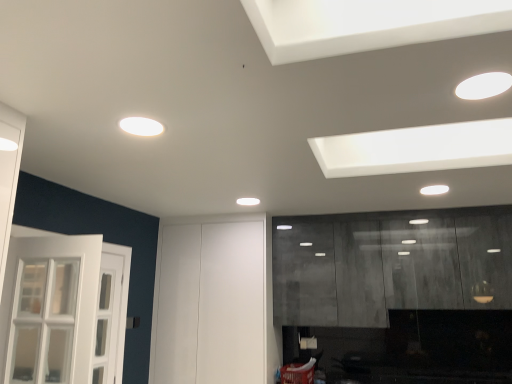
What is the approximate height of white matte light fixture at upper center, which is counted as the 1th lighting, starting from the back?

0.74 inches.

What do you see at coordinates (389, 264) in the screenshot? I see `matte gray cabinetry at right` at bounding box center [389, 264].

Locate an element on the screen. Image resolution: width=512 pixels, height=384 pixels. white matte door at center is located at coordinates (210, 302).

At what (x,y) coordinates should I click in order to perform the action: click on white glossy light fixture at upper right, the 1th lighting when ordered from right to left. Please return your answer as a coordinate pair (x, y). The height and width of the screenshot is (384, 512). Looking at the image, I should click on (484, 86).

Identify the location of white matte light fixture at upper center, the 1th lighting in the left-to-right sequence. The height and width of the screenshot is (384, 512). (141, 126).

Considering the relative positions of matte gray cabinetry at right and white matte light fixture at upper center, the second lighting when ordered from right to left, in the image provided, is matte gray cabinetry at right in front of white matte light fixture at upper center, the second lighting when ordered from right to left,?

No, matte gray cabinetry at right is further to the viewer.

From the image's perspective, which one is positioned higher, matte gray cabinetry at right or white matte light fixture at upper center, marked as the second lighting in a front-to-back arrangement?

white matte light fixture at upper center, marked as the second lighting in a front-to-back arrangement, appears higher in the image.

Is matte gray cabinetry at right facing towards white matte light fixture at upper center, which is the 1th lighting in bottom-to-top order?

Yes, matte gray cabinetry at right is oriented towards white matte light fixture at upper center, which is the 1th lighting in bottom-to-top order.

Is matte gray cabinetry at right not inside white matte light fixture at upper center, marked as the second lighting in a front-to-back arrangement?

Indeed, matte gray cabinetry at right is completely outside white matte light fixture at upper center, marked as the second lighting in a front-to-back arrangement.

Is white matte light fixture at upper center, the second lighting when ordered from right to left, positioned far away from matte gray cabinetry at right?

Indeed, white matte light fixture at upper center, the second lighting when ordered from right to left, is not near matte gray cabinetry at right.

Consider the image. Could you tell me if white matte light fixture at upper center, the 1th lighting in the left-to-right sequence, is facing matte gray cabinetry at right?

No, white matte light fixture at upper center, the 1th lighting in the left-to-right sequence, is not facing towards matte gray cabinetry at right.

Is white matte light fixture at upper center, the 2th lighting in the top-to-bottom sequence, bigger than matte gray cabinetry at right?

Incorrect, white matte light fixture at upper center, the 2th lighting in the top-to-bottom sequence, is not larger than matte gray cabinetry at right.

Locate an element on the screen. This screenshot has height=384, width=512. door below the white matte light fixture at upper center, marked as the second lighting in a front-to-back arrangement (from the image's perspective) is located at coordinates (210, 302).

Based on the photo, from a real-world perspective, which object stands above the other?

white matte light fixture at upper center, the 1th lighting in the left-to-right sequence, from a real-world perspective.

Is white matte light fixture at upper center, marked as the second lighting in a front-to-back arrangement, inside white matte door at center?

No, white matte door at center does not contain white matte light fixture at upper center, marked as the second lighting in a front-to-back arrangement.

Which of these two, white matte door at center or white matte light fixture at upper center, marked as the second lighting in a front-to-back arrangement, is bigger?

white matte door at center.

Are white matte light fixture at upper center, which is the 1th lighting in bottom-to-top order, and white matte door at center making contact?

They are not placed beside each other.

Considering the relative sizes of white matte light fixture at upper center, which is the 1th lighting in bottom-to-top order, and white matte door at center in the image provided, is white matte light fixture at upper center, which is the 1th lighting in bottom-to-top order, wider than white matte door at center?

Incorrect, the width of white matte light fixture at upper center, which is the 1th lighting in bottom-to-top order, does not surpass that of white matte door at center.

Which is correct: white matte light fixture at upper center, marked as the second lighting in a front-to-back arrangement, is inside white matte door at center, or outside of it?

white matte light fixture at upper center, marked as the second lighting in a front-to-back arrangement, is located beyond the bounds of white matte door at center.

Considering the points (134, 133) and (206, 275), which point is behind, point (134, 133) or point (206, 275)?

The point (206, 275) is farther from the camera.

Is white matte door at center far away from matte gray cabinetry at right?

No, white matte door at center is not far from matte gray cabinetry at right.

Is white matte door at center closer to camera compared to matte gray cabinetry at right?

No, white matte door at center is further to the viewer.

In terms of width, does white matte door at center look wider or thinner when compared to matte gray cabinetry at right?

In the image, white matte door at center appears to be wider than matte gray cabinetry at right.

From a real-world perspective, relative to matte gray cabinetry at right, is white matte door at center vertically above or below?

white matte door at center is below matte gray cabinetry at right.

From a real-world perspective, is white matte door at center positioned above or below white glossy light fixture at upper right, acting as the 2th lighting starting from the left?

Clearly, from a real-world perspective, white matte door at center is below white glossy light fixture at upper right, acting as the 2th lighting starting from the left.

Is white matte door at center positioned behind white glossy light fixture at upper right, the second lighting viewed from the back?

Yes, white matte door at center is further from the viewer.

Choose the correct answer: Is white matte door at center inside white glossy light fixture at upper right, acting as the 2th lighting starting from the left, or outside it?

white matte door at center is located beyond the bounds of white glossy light fixture at upper right, acting as the 2th lighting starting from the left.

Considering the positions of objects white matte door at center and white glossy light fixture at upper right, acting as the 1th lighting starting from the top, in the image provided, who is more to the left, white matte door at center or white glossy light fixture at upper right, acting as the 1th lighting starting from the top,?

Positioned to the left is white matte door at center.

From a real-world perspective, which is physically above, matte gray cabinetry at right or white glossy light fixture at upper right, the second lighting viewed from the back?

From a 3D spatial view, white glossy light fixture at upper right, the second lighting viewed from the back, is above.

From the image's perspective, is matte gray cabinetry at right located above white glossy light fixture at upper right, the 1th lighting from the front?

No, from the image's perspective, matte gray cabinetry at right is not over white glossy light fixture at upper right, the 1th lighting from the front.

The height and width of the screenshot is (384, 512). I want to click on the 2nd lighting in front when counting from the matte gray cabinetry at right, so click(484, 86).

Is matte gray cabinetry at right positioned far away from white glossy light fixture at upper right, the second lighting viewed from the back?

Yes.

Locate an element on the screen. This screenshot has width=512, height=384. the 2nd lighting to the left of the matte gray cabinetry at right, starting your count from the anchor is located at coordinates (141, 126).

Identify the location of the 1st lighting above the matte gray cabinetry at right (from the image's perspective). click(141, 126).

Considering their positions, is white matte light fixture at upper center, the 2th lighting in the top-to-bottom sequence, positioned closer to white matte door at center than white glossy light fixture at upper right, the 1th lighting from the front?

white matte light fixture at upper center, the 2th lighting in the top-to-bottom sequence, is closer to white matte door at center.

Based on their spatial positions, is white matte light fixture at upper center, marked as the second lighting in a front-to-back arrangement, or matte gray cabinetry at right closer to white matte door at center?

Among the two, matte gray cabinetry at right is located nearer to white matte door at center.

From the image, which object appears to be farther from matte gray cabinetry at right, white glossy light fixture at upper right, which is the 2th lighting from bottom to top, or white matte light fixture at upper center, the second lighting when ordered from right to left?

white matte light fixture at upper center, the second lighting when ordered from right to left, lies further to matte gray cabinetry at right than the other object.

Estimate the real-world distances between objects in this image. Which object is closer to white glossy light fixture at upper right, the second lighting viewed from the back, matte gray cabinetry at right or white matte door at center?

matte gray cabinetry at right is closer to white glossy light fixture at upper right, the second lighting viewed from the back.

Which object lies further to the anchor point white matte light fixture at upper center, the 1th lighting in the left-to-right sequence, white matte door at center or matte gray cabinetry at right?

The object further to white matte light fixture at upper center, the 1th lighting in the left-to-right sequence, is matte gray cabinetry at right.

When comparing their distances from white matte light fixture at upper center, marked as the second lighting in a front-to-back arrangement, does white glossy light fixture at upper right, the 1th lighting from the front, or white matte door at center seem further?

Among the two, white matte door at center is located further to white matte light fixture at upper center, marked as the second lighting in a front-to-back arrangement.

From the image, which object appears to be farther from white matte door at center, white glossy light fixture at upper right, acting as the 2th lighting starting from the left, or white matte light fixture at upper center, the 1th lighting in the left-to-right sequence?

white glossy light fixture at upper right, acting as the 2th lighting starting from the left, is positioned further to the anchor white matte door at center.

Looking at the image, which one is located further to matte gray cabinetry at right, white matte light fixture at upper center, the 2th lighting in the top-to-bottom sequence, or white matte door at center?

white matte light fixture at upper center, the 2th lighting in the top-to-bottom sequence, lies further to matte gray cabinetry at right than the other object.

You are a GUI agent. You are given a task and a screenshot of the screen. Output one action in this format:
    pyautogui.click(x=<x>, y=<y>)
    Task: Click on the door between white matte light fixture at upper center, which is the 1th lighting in bottom-to-top order, and matte gray cabinetry at right, in the horizontal direction
    Image resolution: width=512 pixels, height=384 pixels.
    Given the screenshot: What is the action you would take?
    pyautogui.click(x=210, y=302)

This screenshot has height=384, width=512. Identify the location of cabinetry positioned between white glossy light fixture at upper right, acting as the 1th lighting starting from the top, and white matte door at center from near to far. (389, 264).

This screenshot has height=384, width=512. I want to click on lighting located between white glossy light fixture at upper right, the second lighting viewed from the back, and white matte door at center in the depth direction, so click(141, 126).

The height and width of the screenshot is (384, 512). What are the coordinates of `lighting positioned between white glossy light fixture at upper right, acting as the 1th lighting starting from the top, and matte gray cabinetry at right from near to far` in the screenshot? It's located at (141, 126).